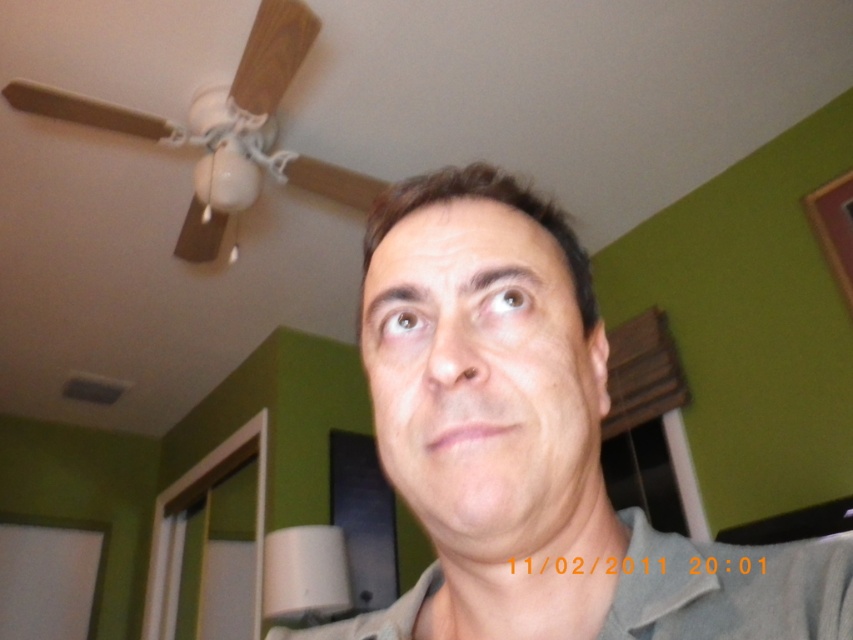
Who is positioned more to the right, gray matte shirt at center or smooth skin face at center?

From the viewer's perspective, smooth skin face at center appears more on the right side.

Is gray matte shirt at center bigger than smooth skin face at center?

Indeed, gray matte shirt at center has a larger size compared to smooth skin face at center.

The height and width of the screenshot is (640, 853). Identify the location of gray matte shirt at center. (532, 445).